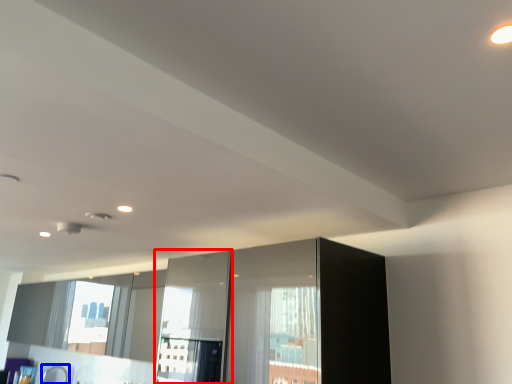
Question: Which point is closer to the camera, screen door (highlighted by a red box) or faucet (highlighted by a blue box)?

Choices:
 (A) screen door
 (B) faucet

Answer: (A)